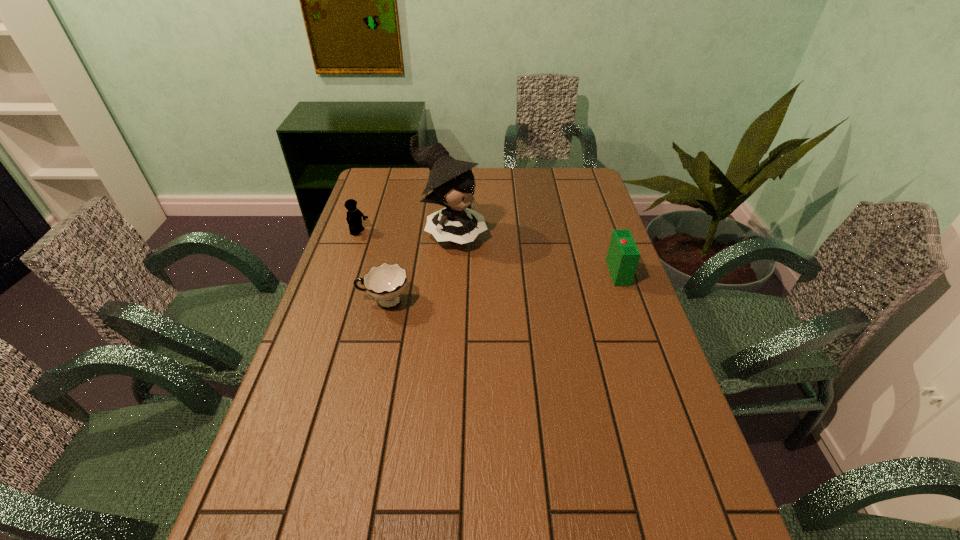
Locate an element on the screen. free area in between the tallest object and the leftmost object is located at coordinates (405, 234).

Choose which object is the nearest neighbor to the leftmost object. Please provide its 2D coordinates. Your answer should be formatted as a tuple, i.e. [(x, y)], where the tuple contains the x and y coordinates of a point satisfying the conditions above.

[(452, 182)]

Locate which object is the second closest to the third farthest object. Please provide its 2D coordinates. Your answer should be formatted as a tuple, i.e. [(x, y)], where the tuple contains the x and y coordinates of a point satisfying the conditions above.

[(386, 282)]

In order to click on blank area in the image that satisfies the following two spatial constraints: 1. on the front side of the Lego; 2. on the right side of the doll in this screenshot , I will do `click(359, 234)`.